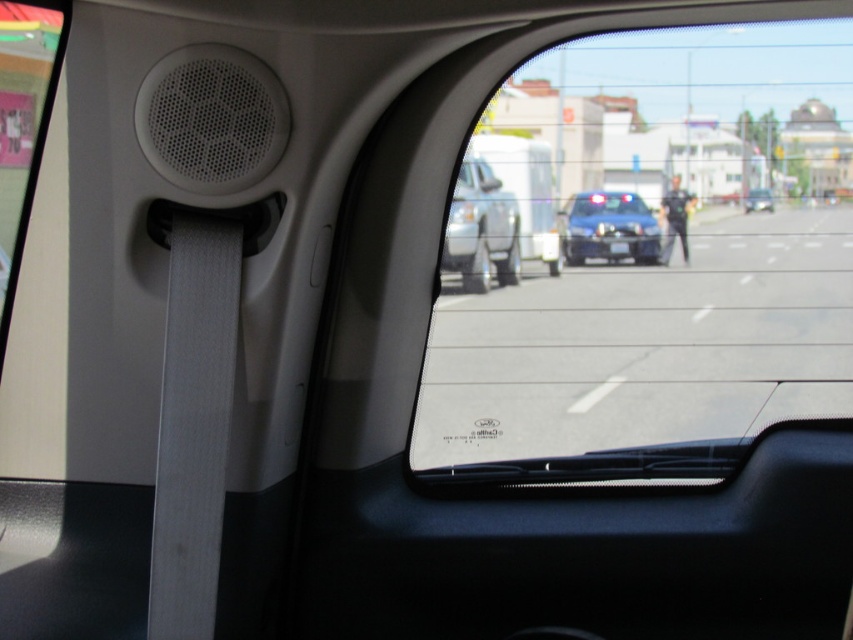
From the picture: Is transparent plastic windshield at center above clear plastic mirror at center?

No.

Between point (608, 413) and point (485, 182), which one is positioned in front?

Point (608, 413) is in front.

Identify the location of transparent plastic windshield at center. (662, 268).

Between metallic silver van at center and clear plastic mirror at center, which one appears on the right side from the viewer's perspective?

clear plastic mirror at center is more to the right.

I want to click on metallic silver van at center, so click(x=480, y=230).

What do you see at coordinates (480, 230) in the screenshot?
I see `metallic silver van at center` at bounding box center [480, 230].

From the picture: Does metallic silver van at center have a lesser height compared to metallic blue sedan at center?

In fact, metallic silver van at center may be taller than metallic blue sedan at center.

Which is behind, point (508, 225) or point (746, 198)?

The point (508, 225) is behind.

This screenshot has width=853, height=640. What are the coordinates of `metallic silver van at center` in the screenshot? It's located at (480, 230).